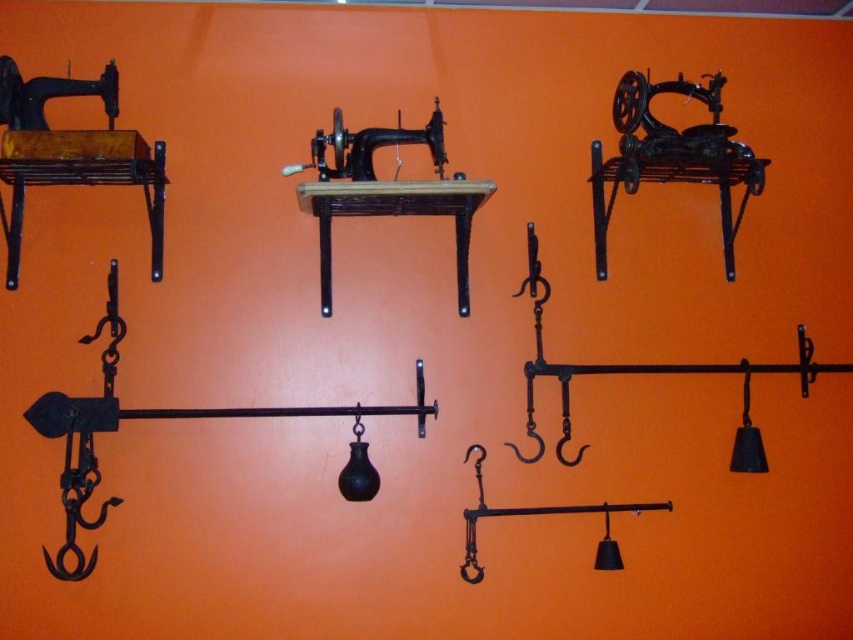
Is matte black sewing machine at upper left above black matte sewing machine at center?

Yes, matte black sewing machine at upper left is above black matte sewing machine at center.

Is point (25, 128) farther from camera compared to point (461, 308)?

No, it is in front of (461, 308).

Image resolution: width=853 pixels, height=640 pixels. Find the location of `matte black sewing machine at upper left`. matte black sewing machine at upper left is located at coordinates (71, 154).

Between black cast iron sewing machine at upper right and black matte sewing machine at center, which one has more height?

black matte sewing machine at center is taller.

Is black cast iron sewing machine at upper right to the right of black matte sewing machine at center from the viewer's perspective?

Correct, you'll find black cast iron sewing machine at upper right to the right of black matte sewing machine at center.

Who is more forward, (728, 176) or (310, 152)?

Point (310, 152)

Image resolution: width=853 pixels, height=640 pixels. I want to click on black cast iron sewing machine at upper right, so click(671, 156).

Does matte black sewing machine at upper left have a lesser height compared to black cast iron sewing machine at upper right?

Incorrect, matte black sewing machine at upper left's height does not fall short of black cast iron sewing machine at upper right's.

Who is taller, matte black sewing machine at upper left or black cast iron sewing machine at upper right?

With more height is matte black sewing machine at upper left.

What do you see at coordinates (71, 154) in the screenshot?
I see `matte black sewing machine at upper left` at bounding box center [71, 154].

The height and width of the screenshot is (640, 853). In order to click on matte black sewing machine at upper left in this screenshot , I will do `click(71, 154)`.